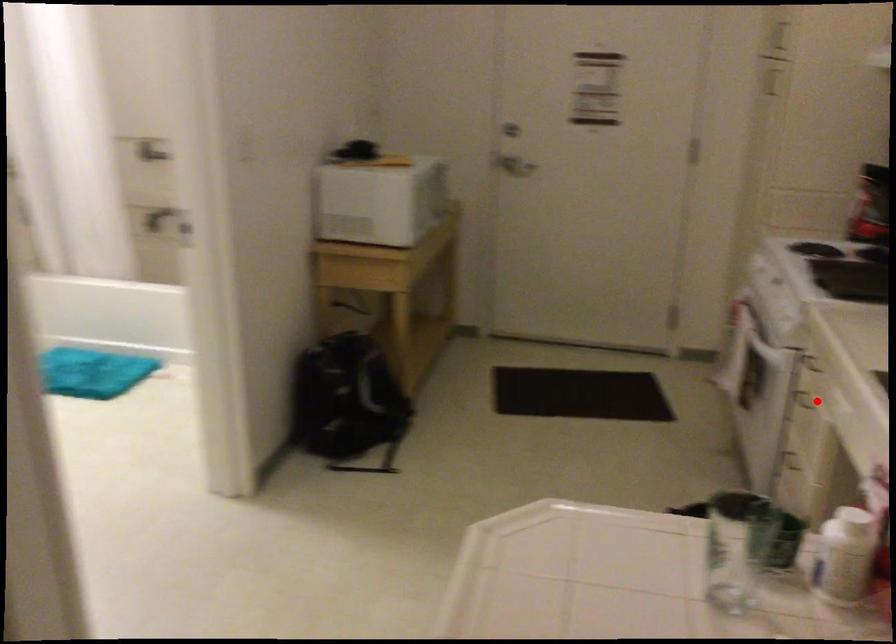
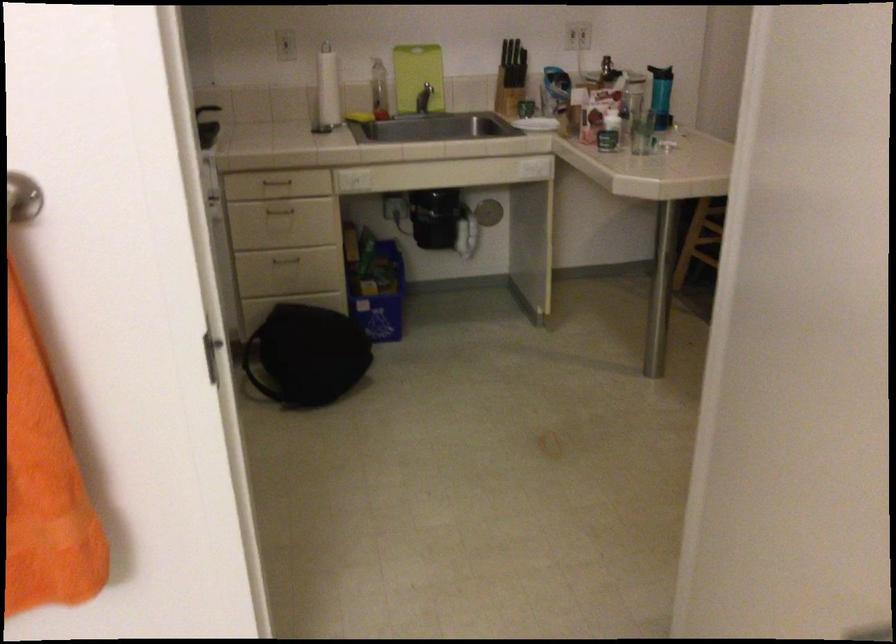
In the second image, find the point that corresponds to the highlighted location in the first image.

(279, 210)